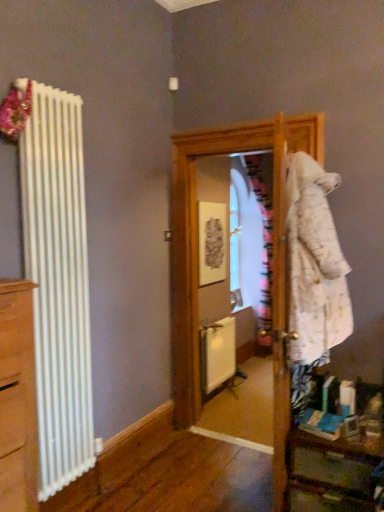
The image size is (384, 512). What do you see at coordinates (333, 453) in the screenshot?
I see `wooden table at lower right` at bounding box center [333, 453].

Where is `wooden table at lower right`? The image size is (384, 512). wooden table at lower right is located at coordinates (333, 453).

You are a GUI agent. You are given a task and a screenshot of the screen. Output one action in this format:
    pyautogui.click(x=<x>, y=<y>)
    Task: Click on the wooden table at lower right
    This screenshot has width=384, height=512.
    Given the screenshot: What is the action you would take?
    pyautogui.click(x=333, y=453)